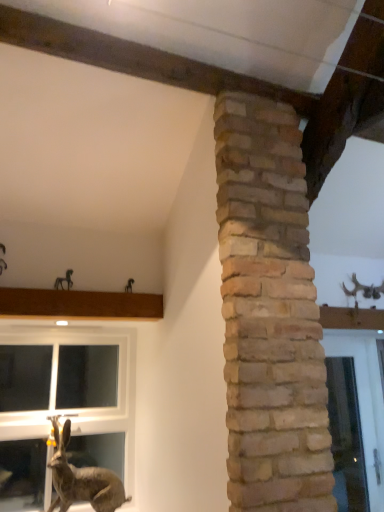
At what (x,y) coordinates should I click in order to perform the action: click on clear glass window at lower left. Please return your answer as a coordinate pair (x, y). Image resolution: width=384 pixels, height=512 pixels. Looking at the image, I should click on (63, 405).

You are a GUI agent. You are given a task and a screenshot of the screen. Output one action in this format:
    pyautogui.click(x=<x>, y=<y>)
    Task: Click on the brown textured rabbit at lower left
    The width and height of the screenshot is (384, 512).
    Given the screenshot: What is the action you would take?
    pyautogui.click(x=81, y=478)

Identify the location of metallic horse at upper left. (64, 281).

In the scene shown: From the image's perspective, is brown wood at upper left on metallic horse at upper left?

No, from the image's perspective, brown wood at upper left is not on top of metallic horse at upper left.

Is brown wood at upper left oriented towards metallic horse at upper left?

No, brown wood at upper left is not oriented towards metallic horse at upper left.

Do you think brown wood at upper left is within metallic horse at upper left, or outside of it?

brown wood at upper left is spatially situated outside metallic horse at upper left.

Can you confirm if metallic horse at upper left is positioned to the left of clear glass window at lower left?

No.

From a real-world perspective, is metallic horse at upper left physically above clear glass window at lower left?

Correct, in the physical world, metallic horse at upper left is higher than clear glass window at lower left.

Can you confirm if metallic horse at upper left is taller than clear glass window at lower left?

No.

Is metallic horse at upper left smaller than brown wood at upper left?

Yes.

From the image's perspective, does metallic horse at upper left appear higher than brown wood at upper left?

Yes.

Looking at this image, how many degrees apart are the facing directions of metallic horse at upper left and brown wood at upper left?

The angle between the facing direction of metallic horse at upper left and the facing direction of brown wood at upper left is 0.352 degrees.

Is metallic horse at upper left inside the boundaries of brown wood at upper left, or outside?

metallic horse at upper left is not enclosed by brown wood at upper left.

Which is behind, point (36, 439) or point (69, 276)?

Positioned behind is point (36, 439).

Is clear glass window at lower left wider than metallic horse at upper left?

Yes, clear glass window at lower left is wider than metallic horse at upper left.

Does clear glass window at lower left touch metallic horse at upper left?

No.

Considering the sizes of clear glass window at lower left and metallic horse at upper left in the image, is clear glass window at lower left bigger or smaller than metallic horse at upper left?

Clearly, clear glass window at lower left is larger in size than metallic horse at upper left.

From a real-world perspective, between brown textured rabbit at lower left and clear glass window at lower left, who is vertically higher?

From a 3D spatial view, clear glass window at lower left is above.

Consider the image. Which is closer, (x=113, y=482) or (x=38, y=347)?

Clearly, point (x=113, y=482) is closer to the camera than point (x=38, y=347).

Is brown textured rabbit at lower left closer to camera compared to clear glass window at lower left?

Yes, brown textured rabbit at lower left is in front of clear glass window at lower left.

In the scene shown: Is brown textured rabbit at lower left oriented away from clear glass window at lower left?

Yes, clear glass window at lower left is at the back of brown textured rabbit at lower left.

From the picture: Which of these two, brown wood at upper left or clear glass window at lower left, is bigger?

Bigger between the two is clear glass window at lower left.

The image size is (384, 512). I want to click on window sill on the right of the clear glass window at lower left, so click(x=79, y=304).

From the image's perspective, which one is positioned lower, brown wood at upper left or clear glass window at lower left?

clear glass window at lower left appears lower in the image.

Is brown wood at upper left closer to camera compared to clear glass window at lower left?

Yes, brown wood at upper left is closer to the camera.

Based on the photo, is brown textured rabbit at lower left taller than metallic horse at upper left?

Yes, brown textured rabbit at lower left is taller than metallic horse at upper left.

How much distance is there between brown textured rabbit at lower left and metallic horse at upper left?

brown textured rabbit at lower left is 35.38 inches from metallic horse at upper left.

Considering the relative positions of brown textured rabbit at lower left and metallic horse at upper left in the image provided, is brown textured rabbit at lower left to the left of metallic horse at upper left from the viewer's perspective?

No, brown textured rabbit at lower left is not to the left of metallic horse at upper left.

Is brown textured rabbit at lower left behind metallic horse at upper left?

No, the depth of brown textured rabbit at lower left is less than that of metallic horse at upper left.

The image size is (384, 512). What are the coordinates of `animal above the brown wood at upper left (from the image's perspective)` in the screenshot? It's located at (64, 281).

This screenshot has height=512, width=384. Identify the location of animal behind the clear glass window at lower left. coord(64,281).

Looking at the image, which one is located closer to metallic horse at upper left, brown wood at upper left or clear glass window at lower left?

brown wood at upper left is positioned closer to the anchor metallic horse at upper left.

From the image, which object appears to be farther from metallic horse at upper left, clear glass window at lower left or brown wood at upper left?

The object further to metallic horse at upper left is clear glass window at lower left.

Consider the image. Considering their positions, is brown wood at upper left positioned further to brown textured rabbit at lower left than metallic horse at upper left?

Among the two, metallic horse at upper left is located further to brown textured rabbit at lower left.

In the scene shown: Considering their positions, is metallic horse at upper left positioned closer to brown wood at upper left than brown textured rabbit at lower left?

metallic horse at upper left lies closer to brown wood at upper left than the other object.

From the image, which object appears to be nearer to metallic horse at upper left, brown textured rabbit at lower left or clear glass window at lower left?

Among the two, clear glass window at lower left is located nearer to metallic horse at upper left.

Looking at the image, which one is located further to brown wood at upper left, clear glass window at lower left or metallic horse at upper left?

Among the two, clear glass window at lower left is located further to brown wood at upper left.

Which object lies nearer to the anchor point clear glass window at lower left, metallic horse at upper left or brown textured rabbit at lower left?

brown textured rabbit at lower left.

Which object lies nearer to the anchor point clear glass window at lower left, brown textured rabbit at lower left or metallic horse at upper left?

The object closer to clear glass window at lower left is brown textured rabbit at lower left.

Find the location of a particular element. The height and width of the screenshot is (512, 384). window between brown wood at upper left and brown textured rabbit at lower left vertically is located at coordinates pyautogui.click(x=63, y=405).

This screenshot has height=512, width=384. I want to click on window sill between metallic horse at upper left and brown textured rabbit at lower left vertically, so click(79, 304).

Find the location of a particular element. This screenshot has height=512, width=384. window that lies between metallic horse at upper left and brown textured rabbit at lower left from top to bottom is located at coordinates (63, 405).

In order to click on window sill that lies between metallic horse at upper left and clear glass window at lower left from top to bottom in this screenshot , I will do pyautogui.click(x=79, y=304).